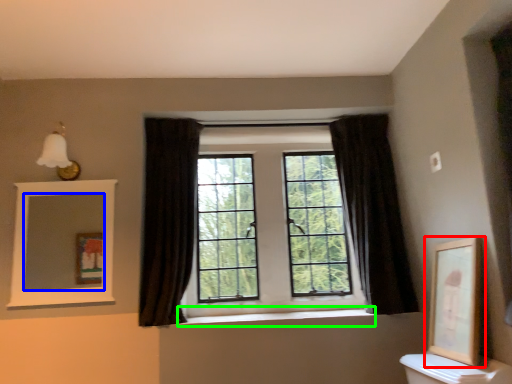
Question: Based on their relative distances, which object is farther from picture frame (highlighted by a red box)? Choose from mirror (highlighted by a blue box) and window sill (highlighted by a green box).

Choices:
 (A) mirror
 (B) window sill

Answer: (A)